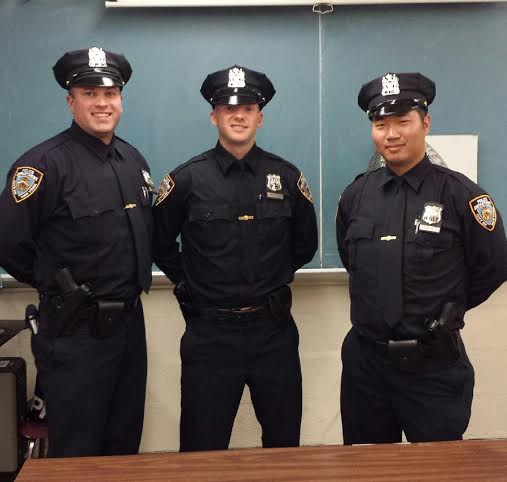
Where is `wall`? wall is located at coordinates (310, 307).